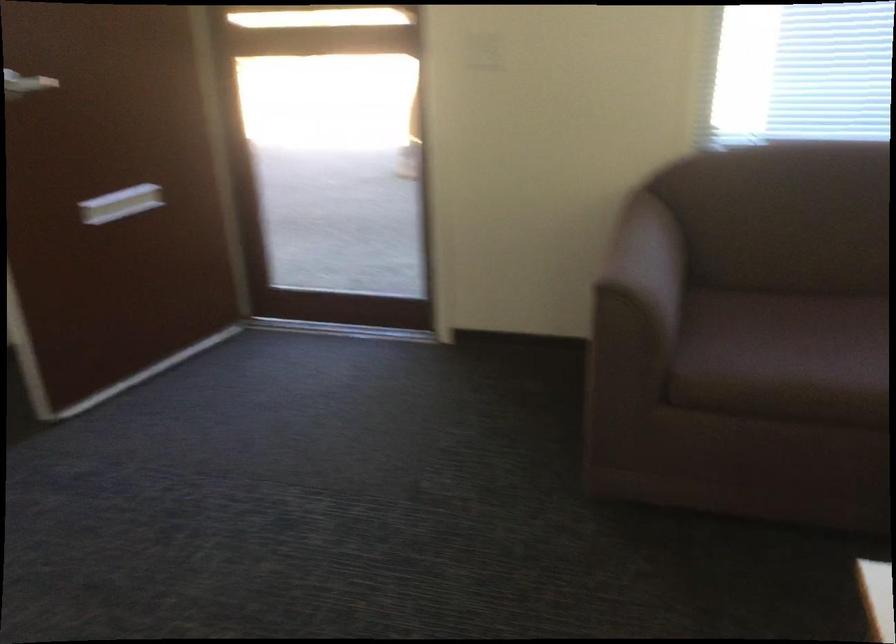
The height and width of the screenshot is (644, 896). What do you see at coordinates (26, 84) in the screenshot?
I see `the white door handle` at bounding box center [26, 84].